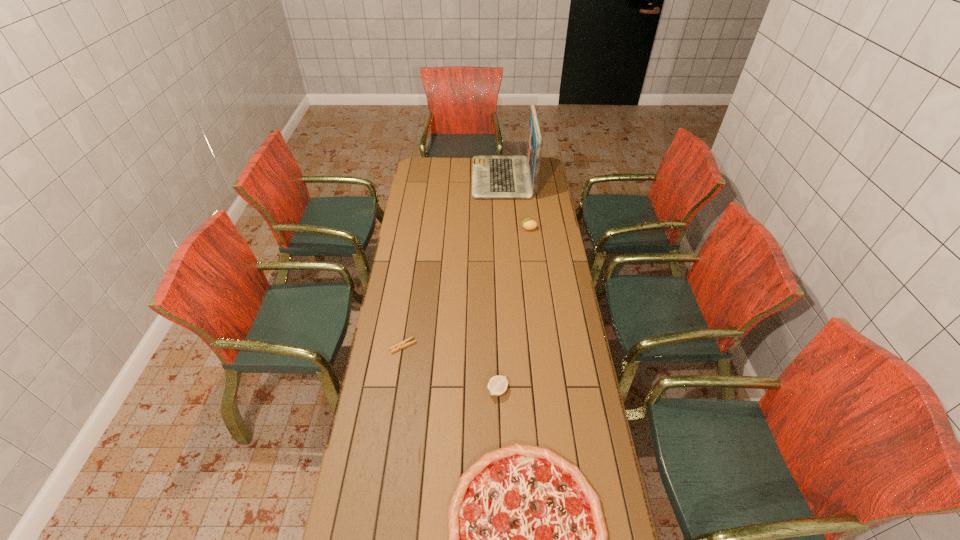
Find the location of a particular element. vacant space located 0.060m on the screen of the tallest object is located at coordinates (462, 178).

Find the location of a particular element. free location located with leaves positioned above the farther lemon is located at coordinates (468, 228).

Image resolution: width=960 pixels, height=540 pixels. I want to click on free spot located 0.370m with leaves positioned above the farther lemon, so click(x=445, y=228).

Locate an element on the screen. The height and width of the screenshot is (540, 960). free space located 0.350m with leaves positioned above the farther lemon is located at coordinates (449, 228).

This screenshot has height=540, width=960. Identify the location of vacant space located on the right of the third tallest object. (556, 390).

Where is `vacant area located on the back of the leftmost object`? The width and height of the screenshot is (960, 540). vacant area located on the back of the leftmost object is located at coordinates (409, 303).

Identify the location of object present at the far edge. This screenshot has width=960, height=540. (493, 176).

In order to click on object at the left edge in this screenshot , I will do `click(405, 343)`.

I want to click on laptop computer located at the right edge, so click(493, 176).

The image size is (960, 540). In order to click on lemon that is at the right edge in this screenshot , I will do `click(528, 224)`.